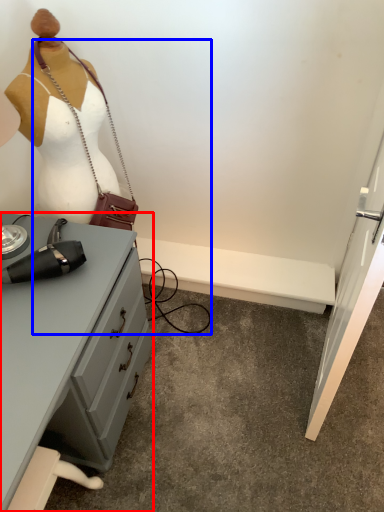
Question: Which object appears closest to the camera in this image, desk (highlighted by a red box) or accessory (highlighted by a blue box)?

Choices:
 (A) desk
 (B) accessory

Answer: (A)